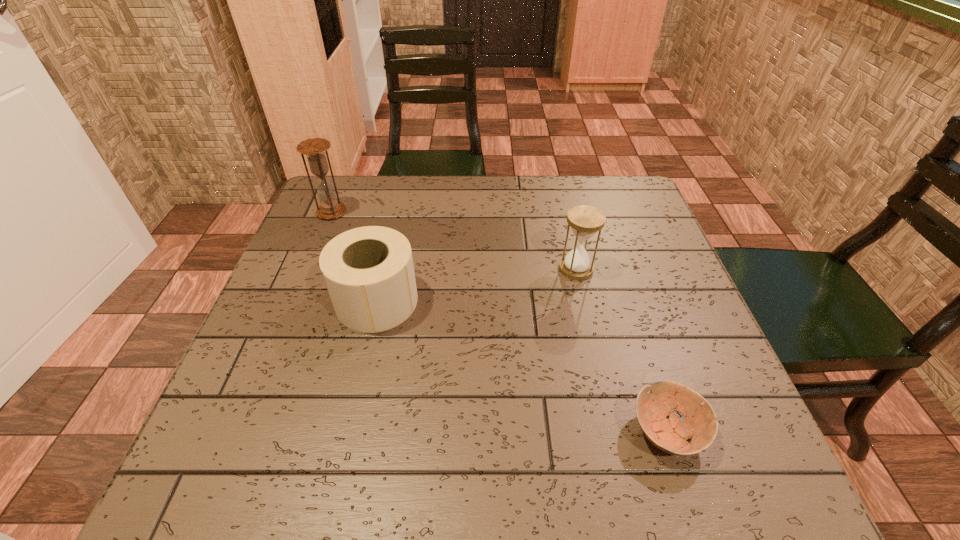
Find the location of a particular element. the farther hourglass is located at coordinates [314, 148].

Locate an element on the screen. the farthest object is located at coordinates (314, 148).

At what (x,y) coordinates should I click in order to perform the action: click on the right hourglass. Please return your answer as a coordinate pair (x, y). The height and width of the screenshot is (540, 960). Looking at the image, I should click on (585, 221).

The width and height of the screenshot is (960, 540). I want to click on the shorter hourglass, so click(x=585, y=221).

I want to click on the third object from right to left, so click(368, 271).

Where is `the shortest object`? the shortest object is located at coordinates (669, 435).

I want to click on bowl, so click(669, 435).

Image resolution: width=960 pixels, height=540 pixels. Identify the location of free space located 0.230m on the right of the farthest object. (433, 212).

Identify the location of vacant space located 0.360m on the left of the nearer hourglass. (403, 269).

At what (x,y) coordinates should I click in order to perform the action: click on free location located on the back of the second object from left to right. Please return your answer as a coordinate pair (x, y). Looking at the image, I should click on [401, 194].